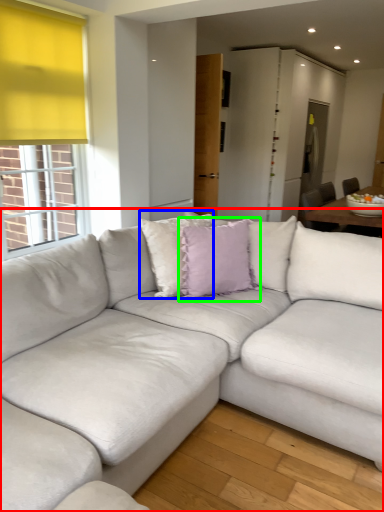
Question: Considering the real-world distances, which object is closest to studio couch (highlighted by a red box)? pillow (highlighted by a blue box) or pillow (highlighted by a green box).

Choices:
 (A) pillow
 (B) pillow

Answer: (B)